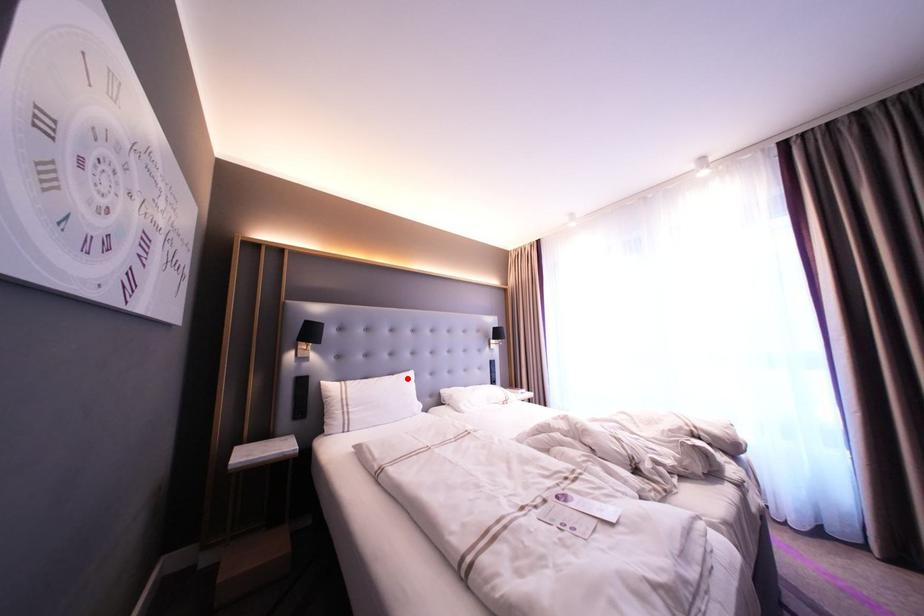
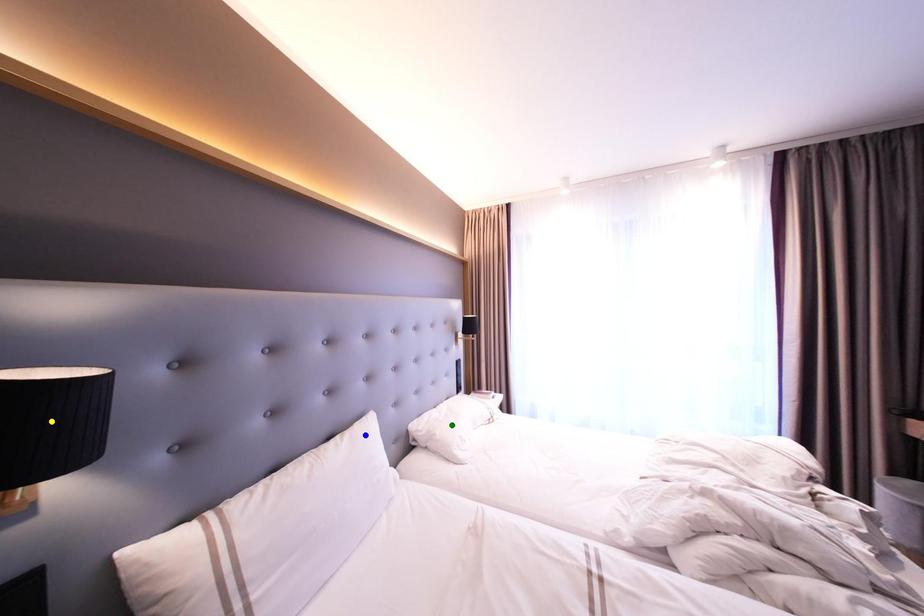
Question: I am providing you with two images of the same scene from different viewpoints. A red point is marked on the first image. You are given multiple points on the second image. Which mark in image 2 goes with the point in image 1?

Choices:
 (A) blue point
 (B) yellow point
 (C) green point

Answer: (A)